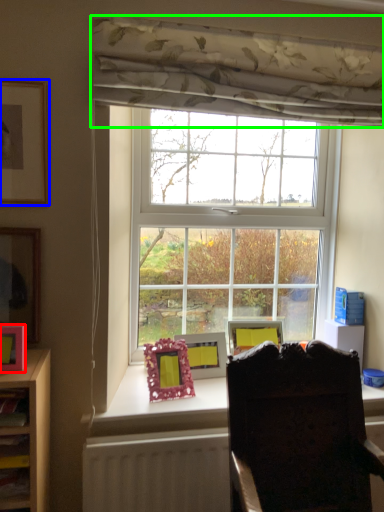
Question: Estimate the real-world distances between objects in this image. Which object is farther from picture frame (highlighted by a red box), picture frame (highlighted by a blue box) or curtain (highlighted by a green box)?

Choices:
 (A) picture frame
 (B) curtain

Answer: (B)